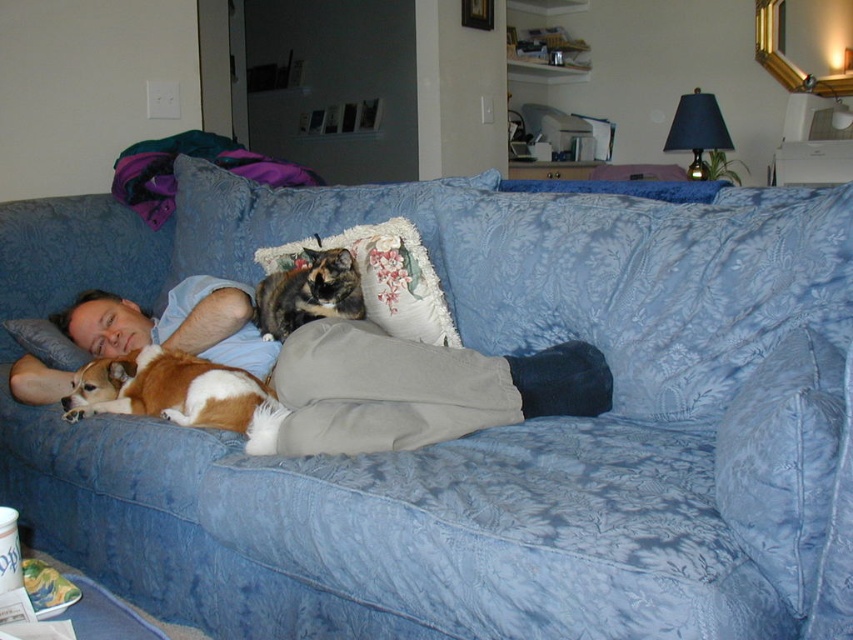
Looking at this image, does light blue fabric pants at center come in front of floral fabric pillow at center?

Yes, it is in front of floral fabric pillow at center.

Is point (244, 364) positioned in front of point (405, 237)?

No, (244, 364) is further to viewer.

Identify the location of light blue fabric pants at center. The image size is (853, 640). (350, 371).

Is point (384, 272) in front of point (323, 257)?

No, (384, 272) is further to viewer.

The image size is (853, 640). What do you see at coordinates (386, 278) in the screenshot? I see `floral fabric pillow at center` at bounding box center [386, 278].

Between point (374, 276) and point (276, 272), which one is positioned in front?

Point (374, 276) is more forward.

The image size is (853, 640). I want to click on floral fabric pillow at center, so click(x=386, y=278).

Who is taller, blue floral fabric couch at center or brown and white fur dog at lower left?

blue floral fabric couch at center is taller.

Does point (631, 481) come in front of point (248, 420)?

Yes, it is in front of point (248, 420).

The image size is (853, 640). What are the coordinates of `blue floral fabric couch at center` in the screenshot? It's located at pyautogui.click(x=479, y=432).